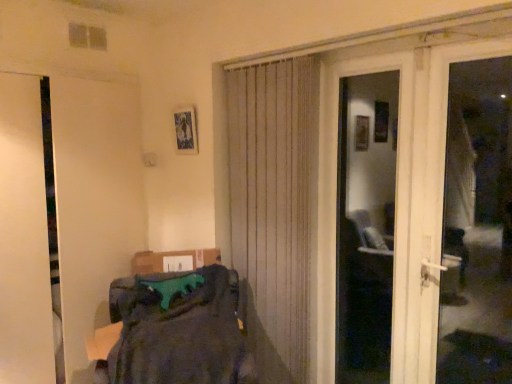
Question: From a real-world perspective, is metallic silver picture frame at upper center physically located above or below beige textured curtain at center?

Choices:
 (A) below
 (B) above

Answer: (B)

Question: Which is correct: metallic silver picture frame at upper center is inside beige textured curtain at center, or outside of it?

Choices:
 (A) inside
 (B) outside

Answer: (B)

Question: Estimate the real-world distances between objects in this image. Which object is closer to the white matte door at left, the 2th door from the right?

Choices:
 (A) dark gray fabric at lower left
 (B) beige textured curtain at center
 (C) white plastic door handle at right
 (D) metallic silver picture frame at upper center
 (E) white glossy door at center, the 1th door from the right

Answer: (D)

Question: Based on their relative distances, which object is farther from the beige textured curtain at center?

Choices:
 (A) white matte door at left, the 2th door from the right
 (B) white glossy door at center, arranged as the second door when viewed from the left
 (C) metallic silver picture frame at upper center
 (D) white plastic door handle at right
 (E) dark gray fabric at lower left

Answer: (D)